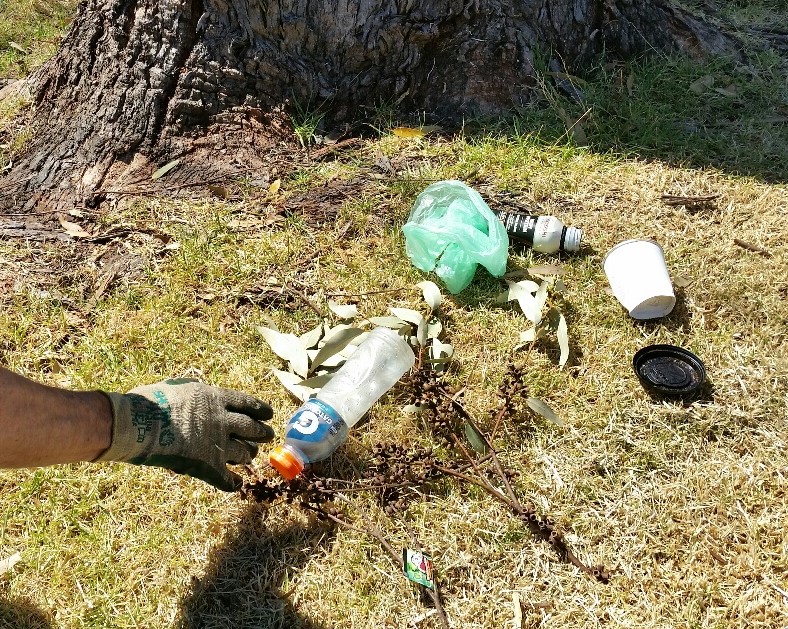
At what (x,y) coordinates should I click in order to perform the action: click on polystyrene cup. Please return your answer as a coordinate pair (x, y). The image size is (788, 629). Looking at the image, I should click on (649, 276).